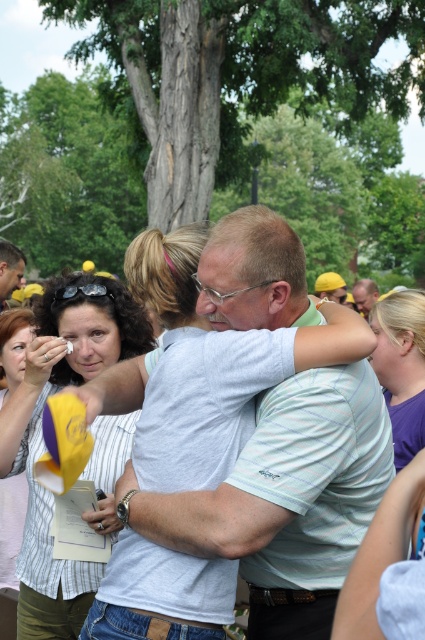
Which is below, matte striped shirt at center or matte gray shirt at center?

matte striped shirt at center is below.

Between point (78, 310) and point (367, 284), which one is positioned behind?

The point (367, 284) is more distant.

Image resolution: width=425 pixels, height=640 pixels. I want to click on matte striped shirt at center, so click(x=42, y=435).

Looking at this image, can you confirm if light blue striped shirt at center is positioned to the right of matte white shirt at center?

Yes, light blue striped shirt at center is to the right of matte white shirt at center.

Is light blue striped shirt at center further to the viewer compared to matte white shirt at center?

No.

Locate an element on the screen. Image resolution: width=425 pixels, height=640 pixels. light blue striped shirt at center is located at coordinates (291, 499).

Identify the location of light blue striped shirt at center. This screenshot has width=425, height=640. (291, 499).

Can you confirm if matte striped shirt at center is smaller than matte white shirt at center?

Indeed, matte striped shirt at center has a smaller size compared to matte white shirt at center.

Is matte striped shirt at center bigger than matte white shirt at center?

No.

I want to click on matte striped shirt at center, so click(x=42, y=435).

Identify the location of matte striped shirt at center. The width and height of the screenshot is (425, 640). (42, 435).